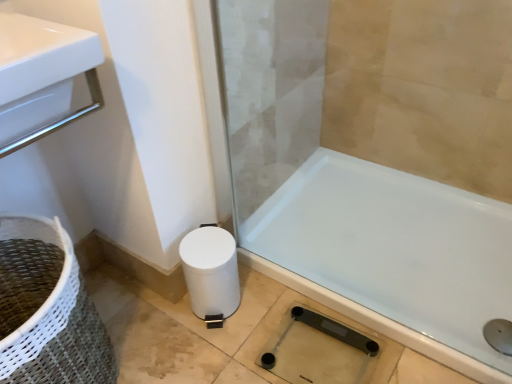
Locate an element on the screen. The image size is (512, 384). vacant space in front of white matte toilet paper at lower left is located at coordinates (211, 354).